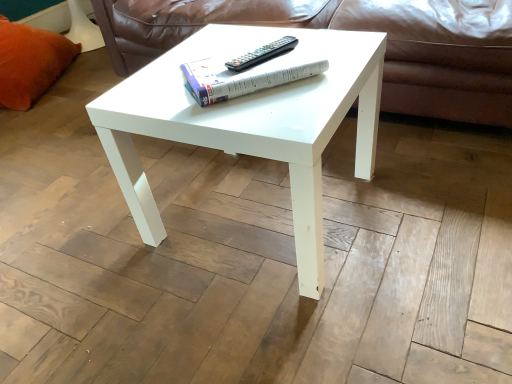
Locate an element on the screen. This screenshot has width=512, height=384. free space to the left of white glossy coffee table at center is located at coordinates (94, 241).